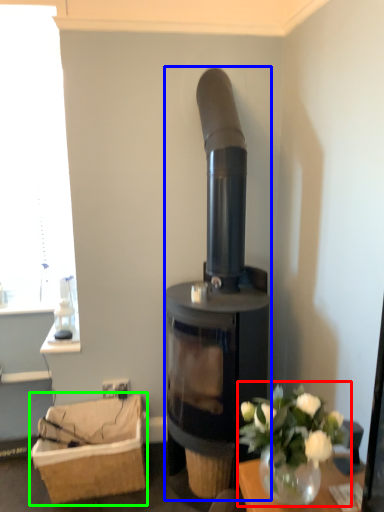
Question: Based on their relative distances, which object is nearer to floral arrangement (highlighted by a red box)? Choose from wood burning stove (highlighted by a blue box) and basket (highlighted by a green box).

Choices:
 (A) wood burning stove
 (B) basket

Answer: (A)